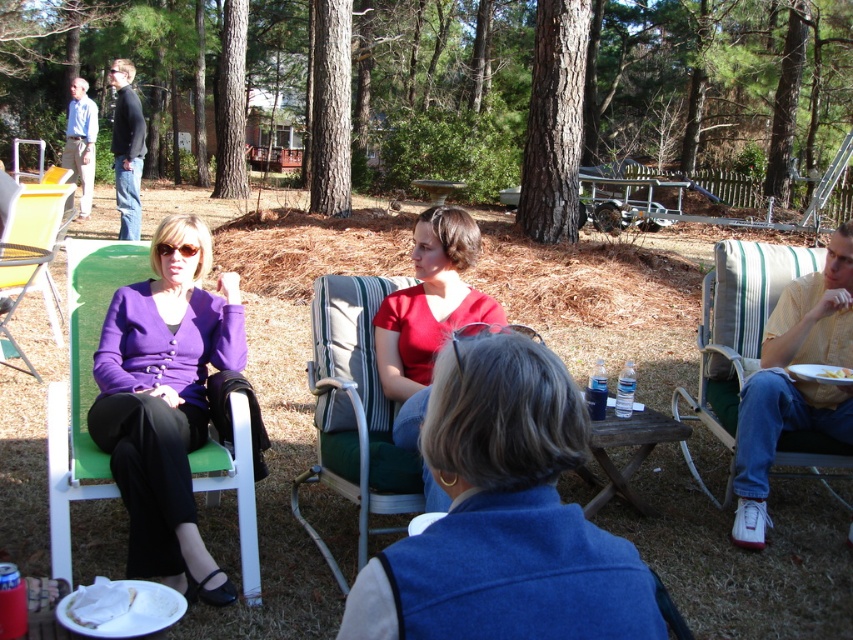
You are a photographer setting up a tripod to capture the scene. You need to ensure that both the matte red shirt at center and the yellow matte plate at lower right are visible in the frame. Given their sizes, which object should you position closer to the edge of the frame to avoid it being cut off?

The yellow matte plate at lower right should be positioned closer to the edge of the frame because it is shorter than the matte red shirt at center, making it less likely to be obscured if placed near the edge.

You are planning to place a decorative item on the table in the scene. The purple matte sweater at left and the yellow matte plate at lower right are already there. Which object has a larger surface area to place the item next to?

The purple matte sweater at left has a larger surface area than the yellow matte plate at lower right since its width surpasses the plate.

You are standing at the center of the outdoor table and want to hand a drink to the person wearing the purple matte sweater at left. In which direction should you move to reach them?

The purple matte sweater at left is located at point (165,401), so you should move to the left side of the table to reach them.